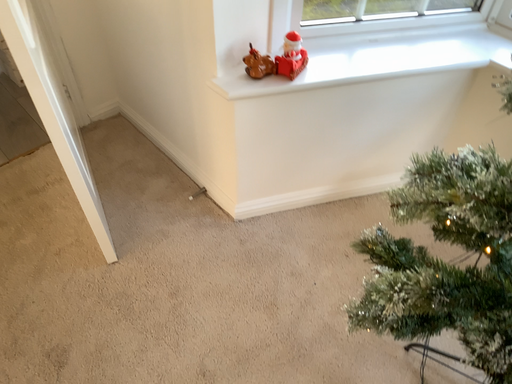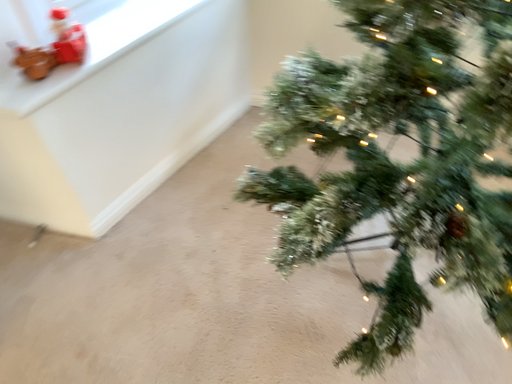
Question: Which way did the camera rotate in the video?

Choices:
 (A) rotated right
 (B) rotated left

Answer: (A)